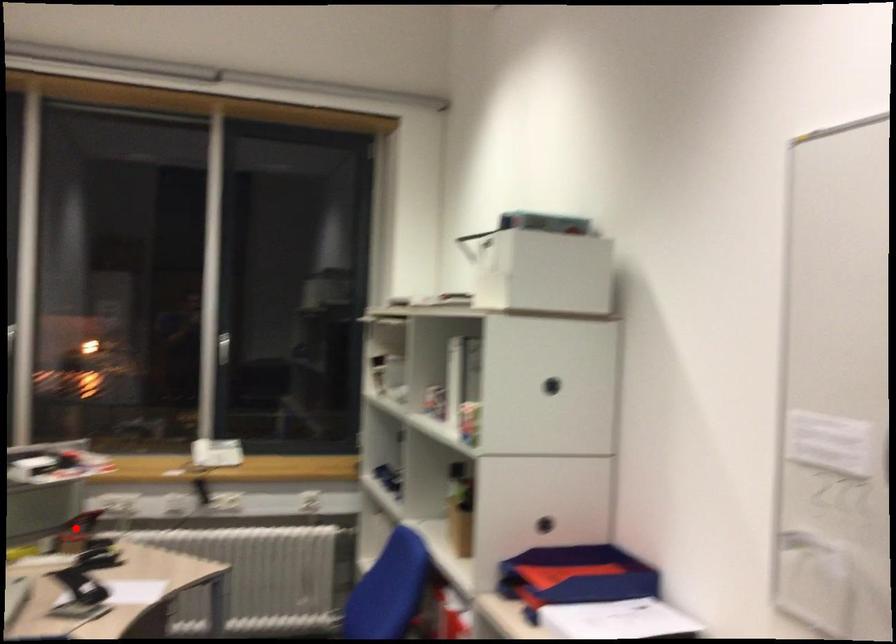
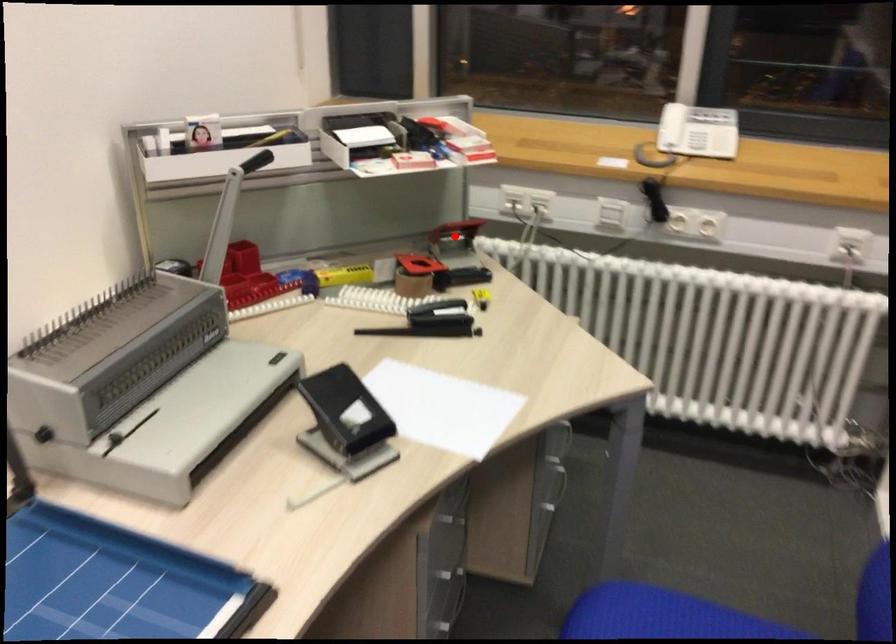
I am providing you with two images of the same scene from different viewpoints. A red point is marked on the first image and another point is marked on the second image. Is the marked point in image1 the same physical position as the marked point in image2?

Yes